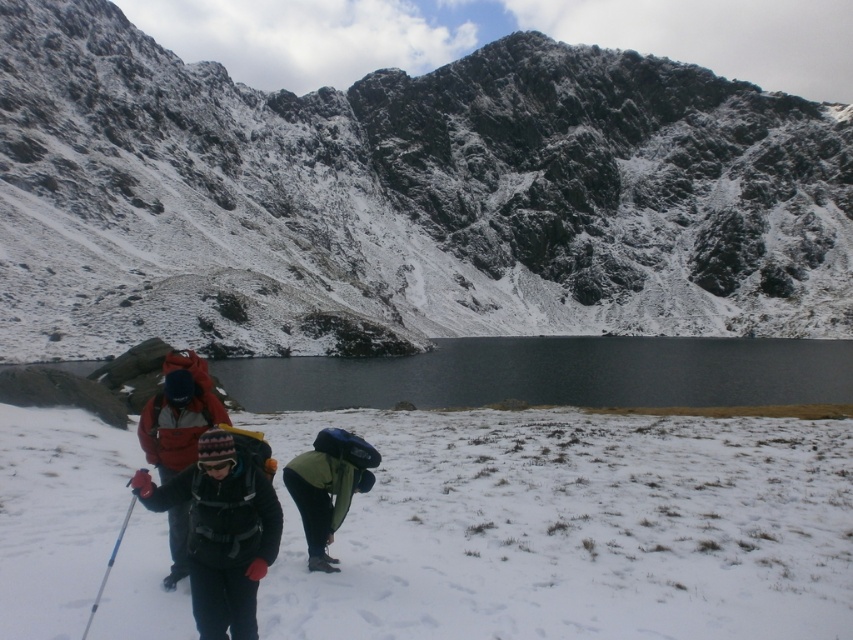
Can you confirm if white fluffy snow at lower center is smaller than blue plastic ski pole at lower left?

No.

Is point (518, 572) farther from viewer compared to point (97, 592)?

That is True.

The image size is (853, 640). Identify the location of white fluffy snow at lower center. click(x=573, y=528).

Is white fluffy snow at lower center shorter than dark gray fleece jacket at center?

Correct, white fluffy snow at lower center is not as tall as dark gray fleece jacket at center.

Between white fluffy snow at lower center and dark gray fleece jacket at center, which one is positioned lower?

Positioned lower is white fluffy snow at lower center.

This screenshot has height=640, width=853. What are the coordinates of `white fluffy snow at lower center` in the screenshot? It's located at (573, 528).

Between point (728, 298) and point (120, 531), which one is positioned behind?

The point (728, 298) is more distant.

Does point (51, 205) come in front of point (109, 554)?

No.

Is point (387, 188) positioned in front of point (114, 541)?

No, it is behind (114, 541).

I want to click on snowy rocky mountain at center, so click(x=403, y=198).